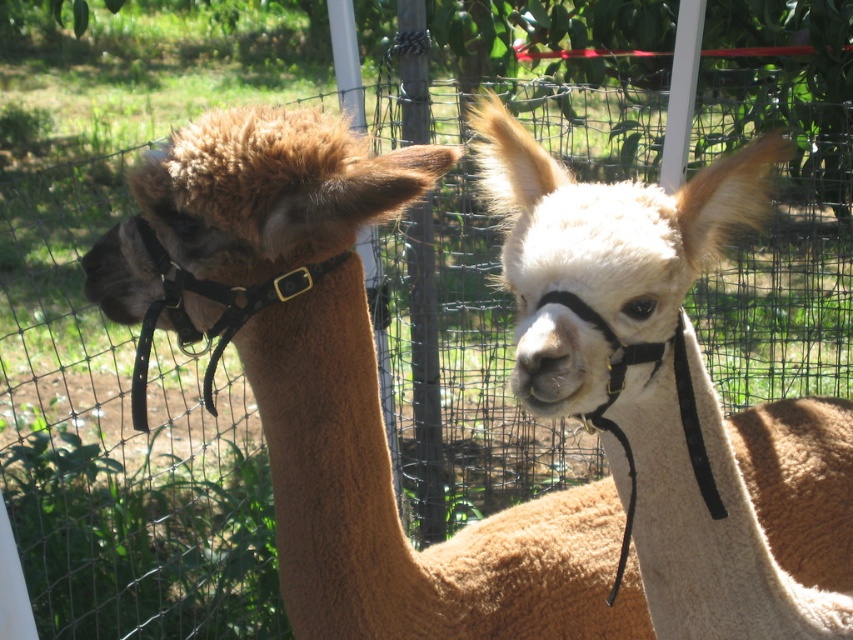
Question: Does white woolen alpaca at center appear over white woolen nose at center?

Choices:
 (A) no
 (B) yes

Answer: (A)

Question: Where is white woolen alpaca at center located in relation to white woolen nose at center in the image?

Choices:
 (A) below
 (B) above

Answer: (A)

Question: Among these points, which one is nearest to the camera?

Choices:
 (A) (741, 188)
 (B) (544, 360)

Answer: (B)

Question: Can you confirm if white woolen alpaca at center is positioned below white woolen nose at center?

Choices:
 (A) no
 (B) yes

Answer: (B)